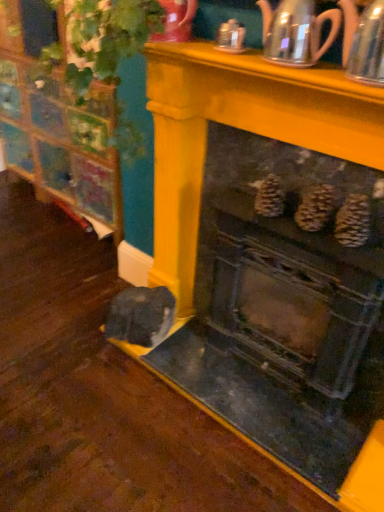
Question: Is clear glass teapot at upper center, which appears as the second tea pot when viewed from the right, looking in the opposite direction of metallic gray fireplace at center?

Choices:
 (A) yes
 (B) no

Answer: (B)

Question: Could you tell me if clear glass teapot at upper center, which appears as the second tea pot when viewed from the right, is turned towards metallic gray fireplace at center?

Choices:
 (A) yes
 (B) no

Answer: (B)

Question: Does clear glass teapot at upper center, which appears as the second tea pot when viewed from the right, come in front of metallic gray fireplace at center?

Choices:
 (A) yes
 (B) no

Answer: (B)

Question: From the image's perspective, is clear glass teapot at upper center, which appears as the second tea pot when viewed from the right, located beneath metallic gray fireplace at center?

Choices:
 (A) yes
 (B) no

Answer: (B)

Question: Is the depth of clear glass teapot at upper center, which appears as the second tea pot when viewed from the right, greater than that of metallic gray fireplace at center?

Choices:
 (A) no
 (B) yes

Answer: (B)

Question: Considering the positions of metallic silver teapot at upper right, acting as the 2th tea pot starting from the left, and metallic gray fireplace at center in the image, is metallic silver teapot at upper right, acting as the 2th tea pot starting from the left, bigger or smaller than metallic gray fireplace at center?

Choices:
 (A) big
 (B) small

Answer: (B)

Question: Is metallic silver teapot at upper right, the 1th tea pot viewed from the right, taller or shorter than metallic gray fireplace at center?

Choices:
 (A) tall
 (B) short

Answer: (B)

Question: Looking at their shapes, would you say metallic silver teapot at upper right, acting as the 2th tea pot starting from the left, is wider or thinner than metallic gray fireplace at center?

Choices:
 (A) thin
 (B) wide

Answer: (A)

Question: From the image's perspective, is metallic silver teapot at upper right, acting as the 2th tea pot starting from the left, located above or below metallic gray fireplace at center?

Choices:
 (A) below
 (B) above

Answer: (B)

Question: Is metallic gray fireplace at center taller or shorter than metallic silver teapot at upper right, acting as the 2th tea pot starting from the left?

Choices:
 (A) short
 (B) tall

Answer: (B)

Question: Visually, is metallic gray fireplace at center positioned to the left or to the right of metallic silver teapot at upper right, the 1th tea pot viewed from the right?

Choices:
 (A) right
 (B) left

Answer: (B)

Question: Relative to metallic silver teapot at upper right, acting as the 2th tea pot starting from the left, is metallic gray fireplace at center in front or behind?

Choices:
 (A) behind
 (B) front

Answer: (A)

Question: Is metallic gray fireplace at center situated inside metallic silver teapot at upper right, acting as the 2th tea pot starting from the left, or outside?

Choices:
 (A) outside
 (B) inside

Answer: (A)

Question: Would you say metallic silver teapot at upper right, acting as the 2th tea pot starting from the left, is to the left or to the right of clear glass teapot at upper center, which appears as the second tea pot when viewed from the right, in the picture?

Choices:
 (A) left
 (B) right

Answer: (B)

Question: Based on their sizes in the image, would you say metallic silver teapot at upper right, acting as the 2th tea pot starting from the left, is bigger or smaller than clear glass teapot at upper center, the first tea pot in the left-to-right sequence?

Choices:
 (A) small
 (B) big

Answer: (B)